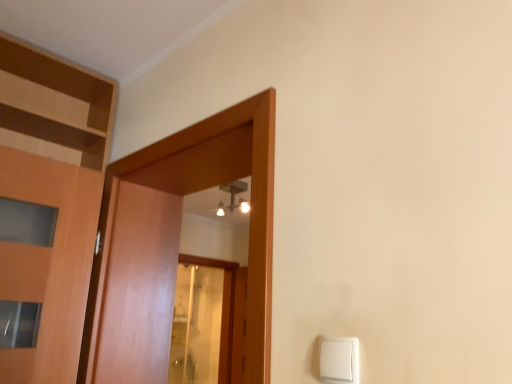
Question: From the image's perspective, does wooden door at center appear higher than white plastic light switch at lower right?

Choices:
 (A) yes
 (B) no

Answer: (A)

Question: Is wooden door at center thinner than white plastic light switch at lower right?

Choices:
 (A) no
 (B) yes

Answer: (A)

Question: Does wooden door at center have a greater height compared to white plastic light switch at lower right?

Choices:
 (A) yes
 (B) no

Answer: (A)

Question: From the image's perspective, does wooden door at center appear lower than white plastic light switch at lower right?

Choices:
 (A) yes
 (B) no

Answer: (B)

Question: Does wooden door at center turn towards white plastic light switch at lower right?

Choices:
 (A) no
 (B) yes

Answer: (A)

Question: Is wooden door at center directly adjacent to white plastic light switch at lower right?

Choices:
 (A) yes
 (B) no

Answer: (B)

Question: Does white plastic light switch at lower right contain wooden door at center?

Choices:
 (A) yes
 (B) no

Answer: (B)

Question: Is white plastic light switch at lower right positioned in front of wooden door at center?

Choices:
 (A) no
 (B) yes

Answer: (B)

Question: Is white plastic light switch at lower right taller than wooden door at center?

Choices:
 (A) yes
 (B) no

Answer: (B)

Question: Is white plastic light switch at lower right thinner than wooden door at center?

Choices:
 (A) yes
 (B) no

Answer: (A)

Question: Considering the relative sizes of white plastic light switch at lower right and wooden door at center in the image provided, is white plastic light switch at lower right smaller than wooden door at center?

Choices:
 (A) yes
 (B) no

Answer: (A)

Question: From the image's perspective, is white plastic light switch at lower right below wooden door at center?

Choices:
 (A) yes
 (B) no

Answer: (A)

Question: From their relative heights in the image, would you say white plastic light switch at lower right is taller or shorter than wooden door at center?

Choices:
 (A) short
 (B) tall

Answer: (A)